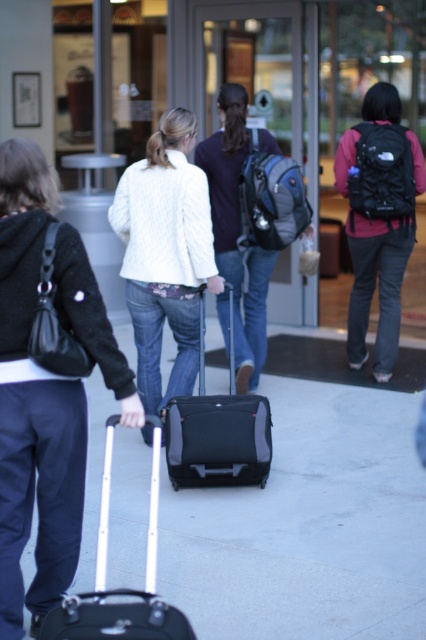
Question: Does matte black suitcase at center have a larger size compared to black hardshell suitcase at center?

Choices:
 (A) yes
 (B) no

Answer: (B)

Question: Is white knitted sweater at center smaller than matte black suitcase at center?

Choices:
 (A) yes
 (B) no

Answer: (B)

Question: Is white knitted sweater at center above matte black suitcase at center?

Choices:
 (A) no
 (B) yes

Answer: (B)

Question: Which object is the farthest from the matte black backpack at center?

Choices:
 (A) matte black suitcase at center
 (B) white knitted sweater at center
 (C) black hardshell suitcase at center
 (D) white matte sweater at center

Answer: (C)

Question: Which object is the closest to the matte black backpack at center?

Choices:
 (A) matte black suitcase at center
 (B) black hardshell suitcase at center
 (C) white matte sweater at center
 (D) white knitted sweater at center

Answer: (D)

Question: Considering the real-world distances, which object is closest to the white knitted sweater at center?

Choices:
 (A) matte black suitcase at center
 (B) matte black backpack at center
 (C) white matte sweater at center

Answer: (A)